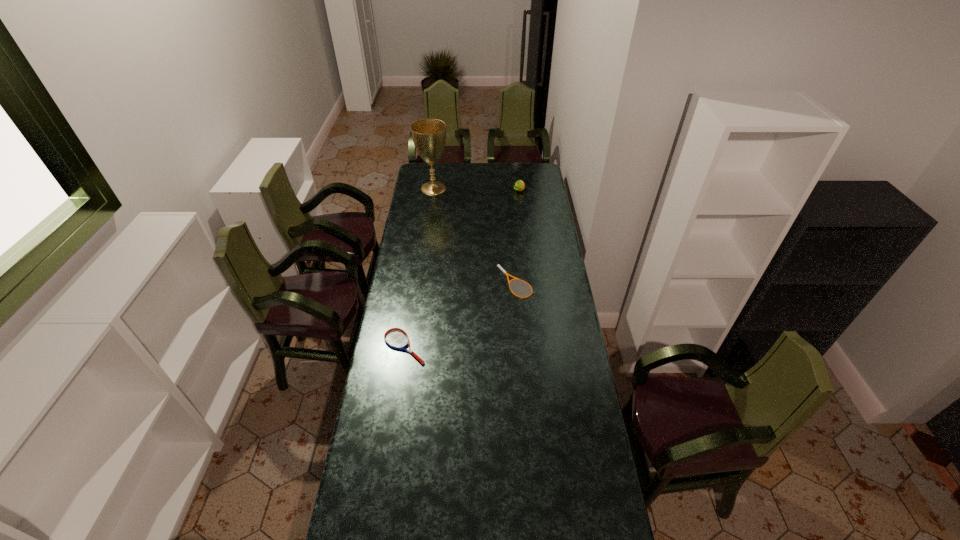
At what (x,y) coordinates should I click in order to perform the action: click on the tallest object. Please return your answer as a coordinate pair (x, y). The width and height of the screenshot is (960, 540). Looking at the image, I should click on (429, 135).

The image size is (960, 540). Find the location of `lemon`. lemon is located at coordinates (519, 185).

Identify the location of the left tennis racket. This screenshot has width=960, height=540. (396, 338).

Find the location of a particular element. the nearer tennis racket is located at coordinates (396, 338).

In order to click on the right tennis racket in this screenshot , I will do `click(498, 265)`.

You are a GUI agent. You are given a task and a screenshot of the screen. Output one action in this format:
    pyautogui.click(x=<x>, y=<y>)
    Task: Click on the farther tennis racket
    This screenshot has height=540, width=960.
    Given the screenshot: What is the action you would take?
    pyautogui.click(x=498, y=265)

At what (x,y) coordinates should I click in order to perform the action: click on vacant space situated 0.190m on the right of the tallest object. Please return your answer as a coordinate pair (x, y). This screenshot has width=960, height=540. Looking at the image, I should click on (481, 188).

Locate an element on the screen. free location located 0.370m with leaves positioned above the second tallest object is located at coordinates (524, 233).

The image size is (960, 540). Identify the location of vacant space located 0.070m on the front of the nearest object. (399, 380).

You are a GUI agent. You are given a task and a screenshot of the screen. Output one action in this format:
    pyautogui.click(x=<x>, y=<y>)
    Task: Click on the vacant space situated on the front of the second nearest object
    Image resolution: width=960 pixels, height=540 pixels.
    Given the screenshot: What is the action you would take?
    pyautogui.click(x=519, y=319)